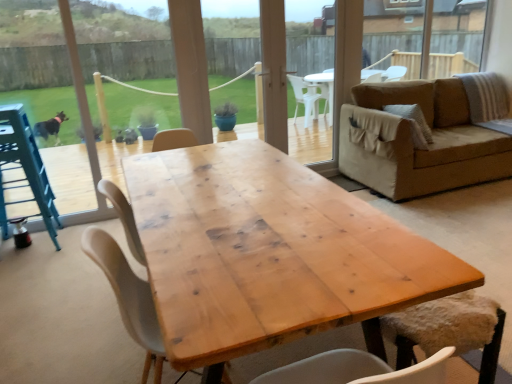
Question: Should I look upward or downward to see fuzzy white chair at lower right, arranged as the second chair when viewed from the left?

Choices:
 (A) up
 (B) down

Answer: (B)

Question: Considering the relative sizes of transparent plastic screen door at center and natural wood table at center in the image provided, is transparent plastic screen door at center smaller than natural wood table at center?

Choices:
 (A) yes
 (B) no

Answer: (A)

Question: Can you confirm if transparent plastic screen door at center is shorter than natural wood table at center?

Choices:
 (A) no
 (B) yes

Answer: (A)

Question: Is transparent plastic screen door at center outside of natural wood table at center?

Choices:
 (A) no
 (B) yes

Answer: (B)

Question: Is transparent plastic screen door at center taller than natural wood table at center?

Choices:
 (A) no
 (B) yes

Answer: (B)

Question: Does transparent plastic screen door at center have a lesser width compared to natural wood table at center?

Choices:
 (A) no
 (B) yes

Answer: (B)

Question: Can you see transparent plastic screen door at center touching natural wood table at center?

Choices:
 (A) no
 (B) yes

Answer: (A)

Question: Is natural wood table at center bigger than metallic blue feeding chair at left?

Choices:
 (A) yes
 (B) no

Answer: (A)

Question: Is natural wood table at center positioned far away from metallic blue feeding chair at left?

Choices:
 (A) no
 (B) yes

Answer: (B)

Question: Is the depth of natural wood table at center less than that of metallic blue feeding chair at left?

Choices:
 (A) no
 (B) yes

Answer: (B)

Question: From a real-world perspective, is natural wood table at center on top of metallic blue feeding chair at left?

Choices:
 (A) yes
 (B) no

Answer: (B)

Question: From a real-world perspective, is natural wood table at center located beneath metallic blue feeding chair at left?

Choices:
 (A) no
 (B) yes

Answer: (B)

Question: Could you tell me if natural wood table at center is facing metallic blue feeding chair at left?

Choices:
 (A) no
 (B) yes

Answer: (A)

Question: Is white matte chair at center, which is the second chair in right-to-left order, at the left side of natural wood table at center?

Choices:
 (A) no
 (B) yes

Answer: (B)